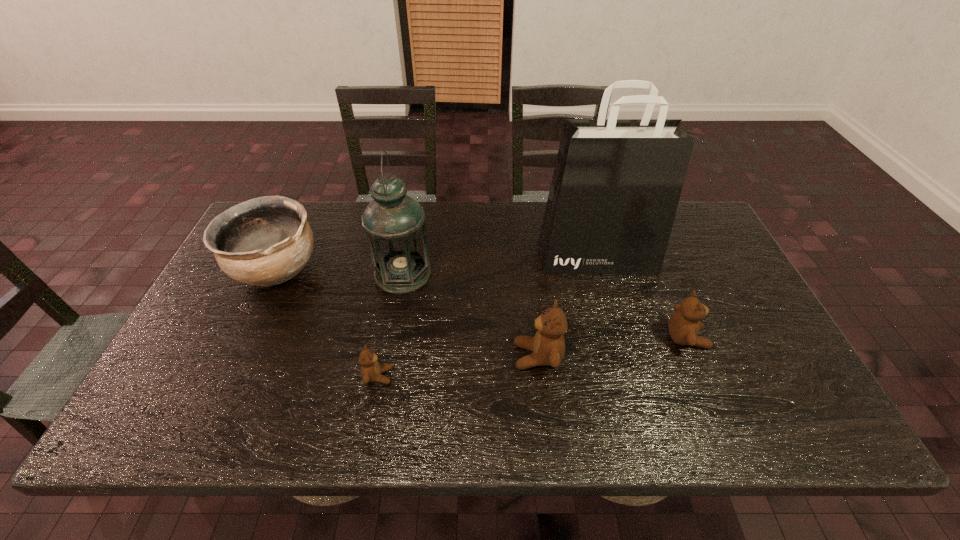
In the image, there is a desktop. Where is `free space at the far edge`? The image size is (960, 540). free space at the far edge is located at coordinates pyautogui.click(x=364, y=207).

In the image, there is a desktop. Where is `vacant space at the near edge`? vacant space at the near edge is located at coordinates (442, 398).

You are a GUI agent. You are given a task and a screenshot of the screen. Output one action in this format:
    pyautogui.click(x=<x>, y=<y>)
    Task: Click on the vacant space at the left edge of the desktop
    Image resolution: width=960 pixels, height=540 pixels.
    Given the screenshot: What is the action you would take?
    pyautogui.click(x=258, y=300)

The height and width of the screenshot is (540, 960). I want to click on vacant region at the right edge of the desktop, so click(710, 257).

The height and width of the screenshot is (540, 960). In the image, there is a desktop. In order to click on vacant space at the near left corner in this screenshot , I will do `click(200, 378)`.

Identify the location of free location at the far right corner of the desktop. This screenshot has height=540, width=960. (692, 220).

In order to click on vacant area at the near right corner of the desktop in this screenshot , I will do `click(762, 374)`.

Where is `free spot between the pottery and the leftmost teddy bear`? free spot between the pottery and the leftmost teddy bear is located at coordinates (327, 323).

At what (x,y) coordinates should I click in order to perform the action: click on vacant region between the fifth tallest object and the pottery. Please return your answer as a coordinate pair (x, y). Looking at the image, I should click on (482, 304).

The height and width of the screenshot is (540, 960). I want to click on unoccupied position between the leftmost object and the tallest object, so click(437, 263).